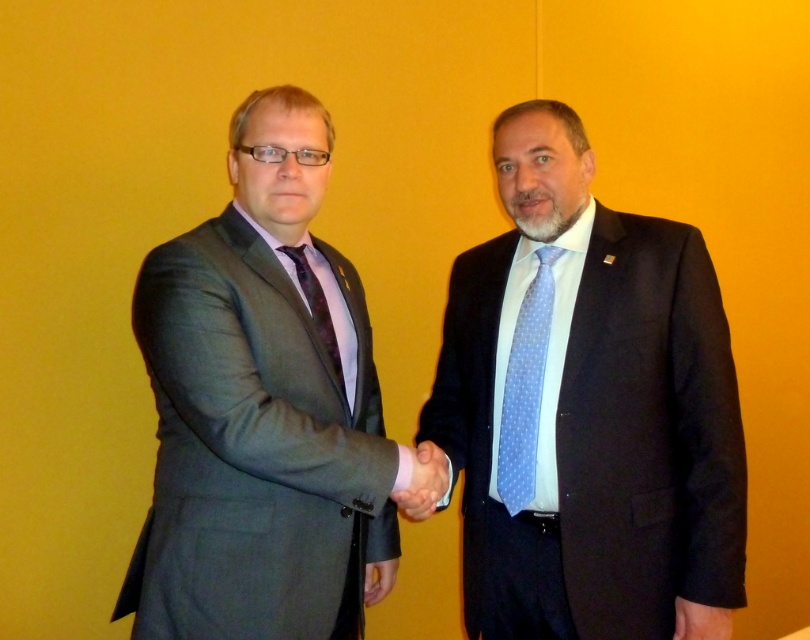
Question: Estimate the real-world distances between objects in this image. Which object is closer to the matte gray suit at left?

Choices:
 (A) blue dotted fabric tie at center
 (B) matte purple tie at center
 (C) dark blue suit at center

Answer: (B)

Question: Can you confirm if matte gray suit at left is smaller than matte black hand at center?

Choices:
 (A) no
 (B) yes

Answer: (A)

Question: Is blue dotted fabric tie at center behind matte black hand at center?

Choices:
 (A) no
 (B) yes

Answer: (B)

Question: Which object is positioned farthest from the matte gray suit at left?

Choices:
 (A) matte black hand at center
 (B) matte purple tie at center
 (C) dark blue suit at center

Answer: (C)

Question: Which object appears closest to the camera in this image?

Choices:
 (A) blue dotted fabric tie at center
 (B) matte purple tie at center
 (C) matte gray suit at left

Answer: (C)

Question: Is blue dotted fabric tie at center thinner than matte purple tie at center?

Choices:
 (A) yes
 (B) no

Answer: (A)